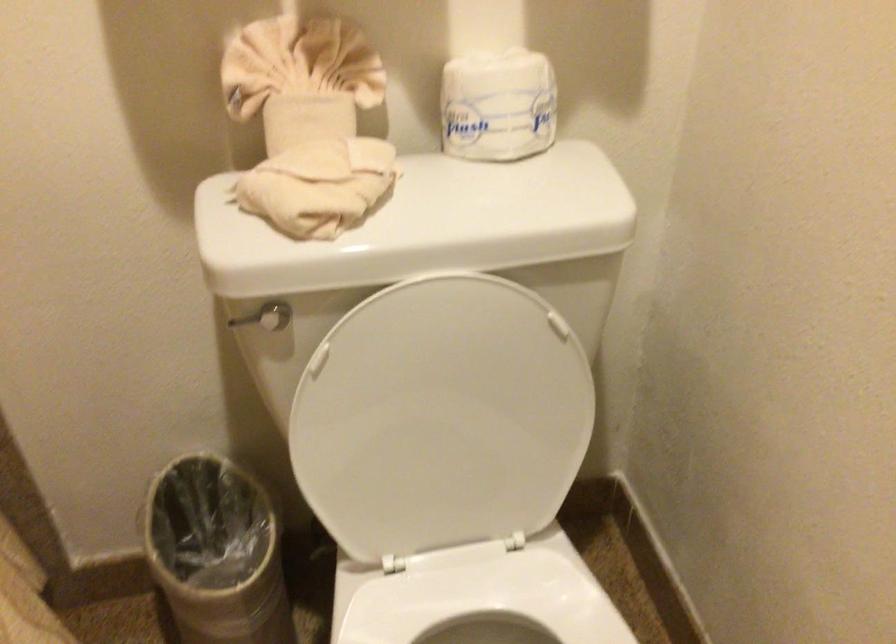
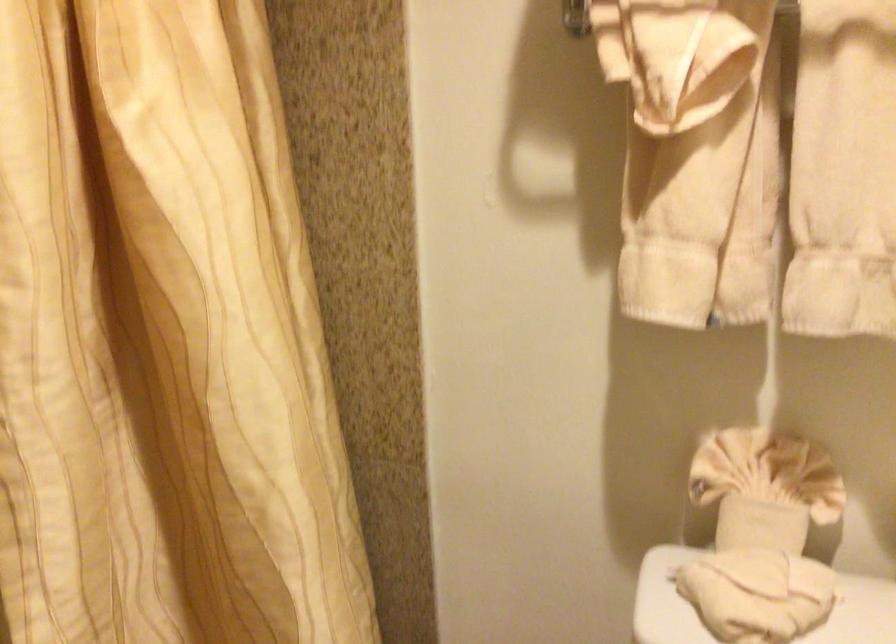
Question: The camera is either moving clockwise (left) or counter-clockwise (right) around the object. The first image is from the beginning of the video and the second image is from the end. Is the camera moving left or right when shooting the video?

Choices:
 (A) Left
 (B) Right

Answer: (B)